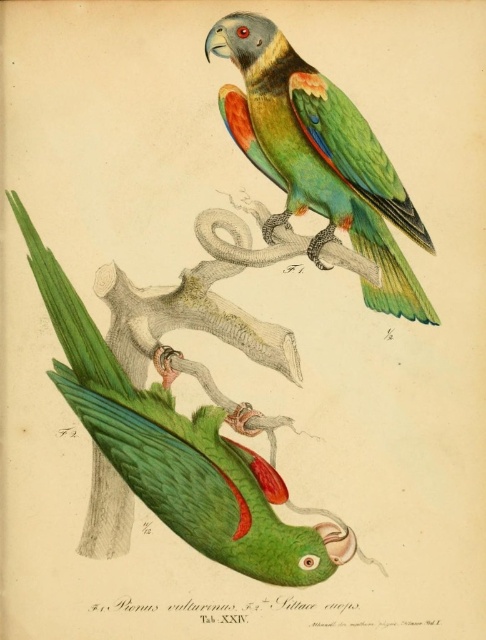
Based on the photo, you are an ornithologist examining the botanical illustration. You want to observe the parrot with the red eye patch first. Which parrot should you focus on first, the green matte parrot at lower left or the green matte parrot at center?

The green matte parrot at lower left is closer to the viewer, so you should focus on the green matte parrot at lower left first to observe the red eye patch.

You are an ornithologist studying the spatial arrangement of parrots in this botanical illustration. Given that you can only observe the green matte parrot at lower left and the green matte parrot at center, which parrot is positioned lower in the image?

The green matte parrot at lower left is positioned lower than the green matte parrot at center in the image.

You are an ornithologist examining the botanical illustration. You need to determine which parrot has a larger body size based on their depiction. Which parrot has a greater width between the two green matte parrot at lower left and green matte parrot at center?

The green matte parrot at lower left has a greater width compared to the green matte parrot at center, as stated in the description.